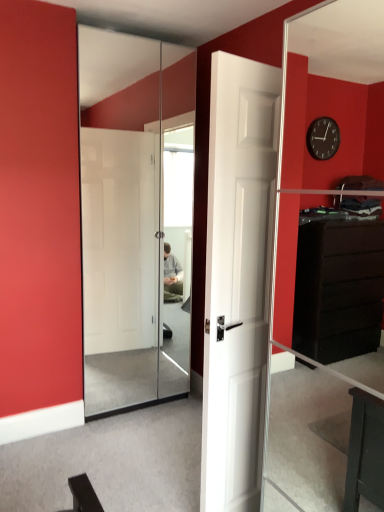
Question: From the image's perspective, relative to white glossy sliding doors at center, is white matte door at center above or below?

Choices:
 (A) below
 (B) above

Answer: (A)

Question: Do you think white matte door at center is within white glossy sliding doors at center, or outside of it?

Choices:
 (A) inside
 (B) outside

Answer: (B)

Question: Visually, is white matte door at center positioned to the left or to the right of white glossy sliding doors at center?

Choices:
 (A) right
 (B) left

Answer: (A)

Question: Considering the positions of white glossy sliding doors at center and white matte door at center in the image, is white glossy sliding doors at center bigger or smaller than white matte door at center?

Choices:
 (A) small
 (B) big

Answer: (A)

Question: In the image, is white glossy sliding doors at center on the left side or the right side of white matte door at center?

Choices:
 (A) left
 (B) right

Answer: (A)

Question: In terms of width, does white glossy sliding doors at center look wider or thinner when compared to white matte door at center?

Choices:
 (A) wide
 (B) thin

Answer: (B)

Question: From the image's perspective, is white glossy sliding doors at center above or below white matte door at center?

Choices:
 (A) above
 (B) below

Answer: (A)